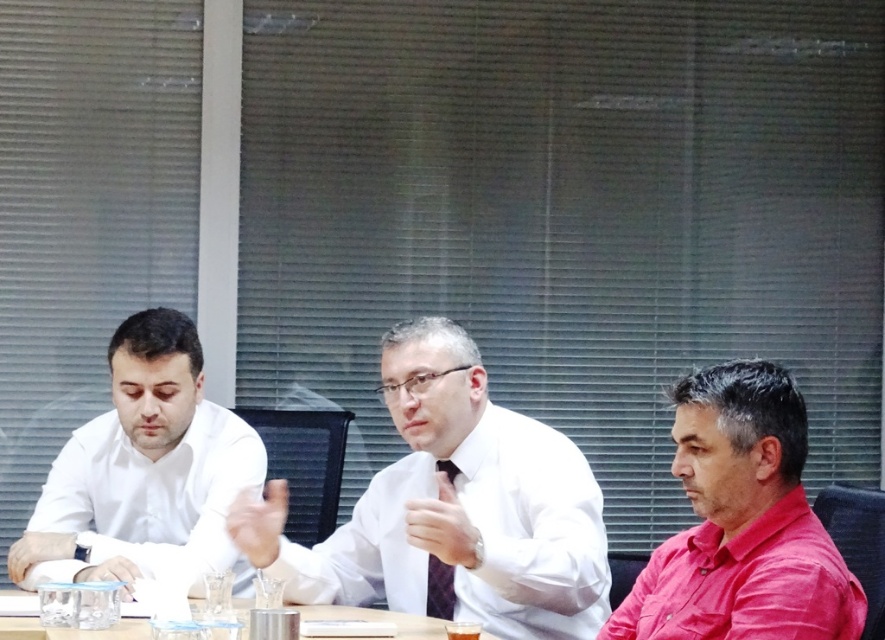
Question: Which is nearer to the matte pink shirt at lower right?

Choices:
 (A) clear plastic cups at center
 (B) white glossy shirt at center
 (C) white glossy shirt at left
 (D) plaid fabric tie at center

Answer: (B)

Question: Can you confirm if matte pink shirt at lower right is thinner than clear plastic cups at center?

Choices:
 (A) no
 (B) yes

Answer: (B)

Question: Is white glossy shirt at center thinner than matte pink shirt at lower right?

Choices:
 (A) no
 (B) yes

Answer: (A)

Question: Is white glossy shirt at left below plaid fabric tie at center?

Choices:
 (A) yes
 (B) no

Answer: (B)

Question: Which point is closer to the camera taking this photo?

Choices:
 (A) (789, 580)
 (B) (129, 602)

Answer: (A)

Question: Based on their relative distances, which object is farther from the plaid fabric tie at center?

Choices:
 (A) clear plastic cups at center
 (B) white glossy shirt at center

Answer: (A)